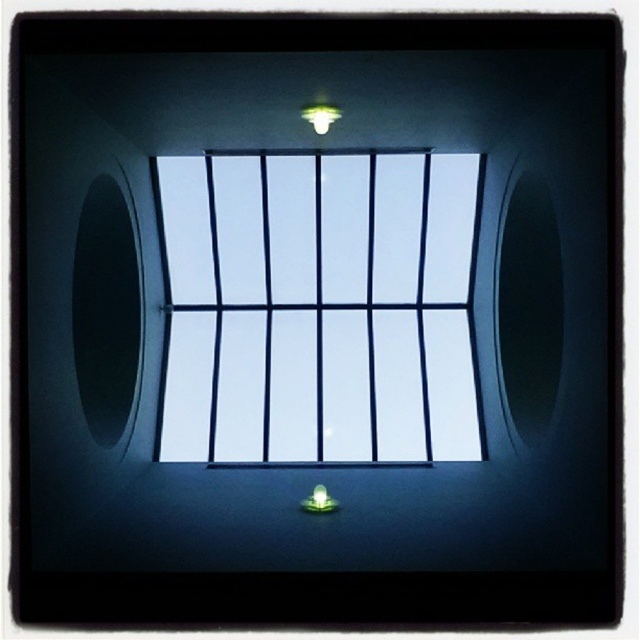
You are an interior designer assessing the lighting in a room with a skylight. You notice the transparent glass window at center and the matte white light at upper center. Which object is positioned higher in the scene?

The matte white light at upper center is positioned higher than the transparent glass window at center.

You are an architect designing a new building and want to ensure that the transparent glass window at center and the matte white light at upper center are spaced at least 5 meters apart for safety regulations. Based on the image, does the current spacing meet the requirement?

The transparent glass window at center and matte white light at upper center are 4.58 meters apart, which is less than the required 5 meters. Therefore, the current spacing does not meet the safety regulations.